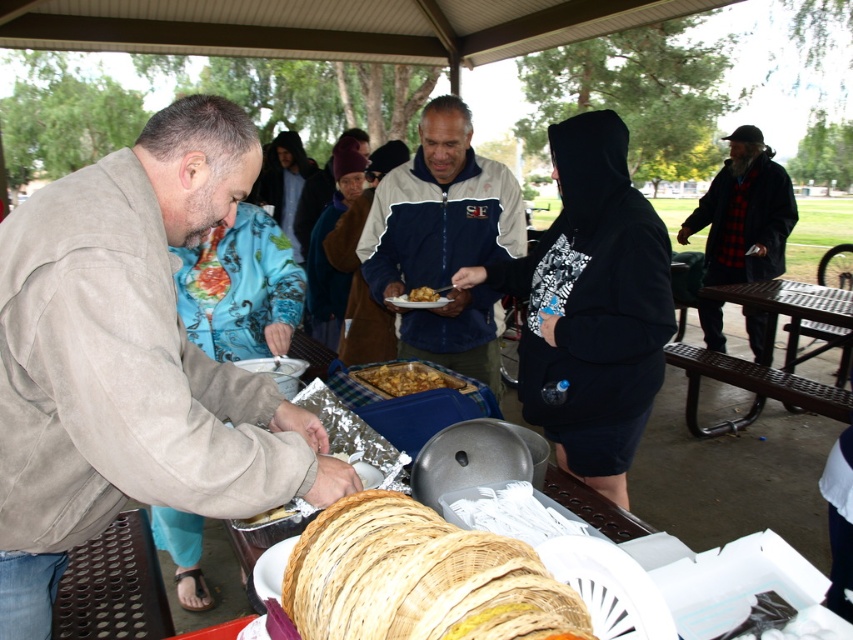
Who is more forward, (364, 253) or (265, 518)?

Positioned in front is point (265, 518).

What are the coordinates of `navy blue jacket at center` in the screenshot? It's located at pos(444,241).

Measure the distance between navy blue jacket at center and camera.

navy blue jacket at center and camera are 2.19 meters apart.

Identify the location of navy blue jacket at center. (444, 241).

Is navy blue jacket at center below golden brown crumbly at center?

No.

At what (x,y) coordinates should I click in order to perform the action: click on navy blue jacket at center. Please return your answer as a coordinate pair (x, y). The image size is (853, 640). Looking at the image, I should click on (444, 241).

The width and height of the screenshot is (853, 640). I want to click on navy blue jacket at center, so click(x=444, y=241).

Does flannel shirt at right have a lesser height compared to golden brown flaky pie at center?

Incorrect, flannel shirt at right's height does not fall short of golden brown flaky pie at center's.

Does flannel shirt at right lie in front of golden brown flaky pie at center?

No, it is behind golden brown flaky pie at center.

What do you see at coordinates (744, 212) in the screenshot? The height and width of the screenshot is (640, 853). I see `flannel shirt at right` at bounding box center [744, 212].

At what (x,y) coordinates should I click in order to perform the action: click on flannel shirt at right. Please return your answer as a coordinate pair (x, y). Looking at the image, I should click on (744, 212).